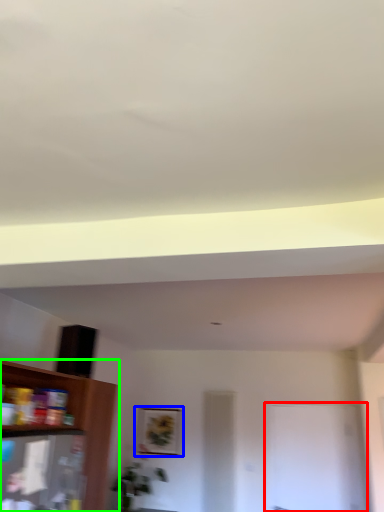
Question: Which object is the farthest from glass door (highlighted by a red box)? Choose among these: picture frame (highlighted by a blue box) or shelf (highlighted by a green box).

Choices:
 (A) picture frame
 (B) shelf

Answer: (B)